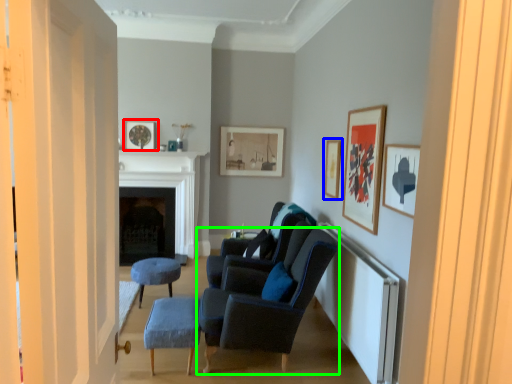
Question: Estimate the real-world distances between objects in this image. Which object is closer to picture frame (highlighted by a red box), picture frame (highlighted by a blue box) or chair (highlighted by a green box)?

Choices:
 (A) picture frame
 (B) chair

Answer: (A)